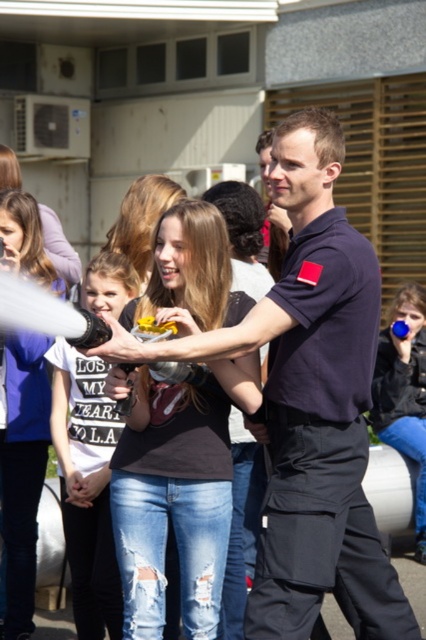
You are a photographer trying to capture a clear photo of the white cotton shirt at center and the matte black hair at center. Since you want to focus on both, which object should you adjust your camera settings to prioritize focusing on first?

The white cotton shirt at center is thinner than matte black hair at center, so you should prioritize focusing on the matte black hair at center first because it has more depth and detail to capture.

You are organizing a charity event and need to set up a photo booth. You have a dark blue uniform at center and a blue matte cup at lower right. Which item should you choose if you want something that can be seen clearly from a distance?

The dark blue uniform at center is larger in size than the blue matte cup at lower right, so the dark blue uniform at center will be more visible from a distance.

You are a photographer taking a picture of the scene. You notice the white cotton shirt at center and the matte black hair at center. Which object will appear larger in your photo?

The white cotton shirt at center will appear larger in the photo because it is closer to the viewer than the matte black hair at center.